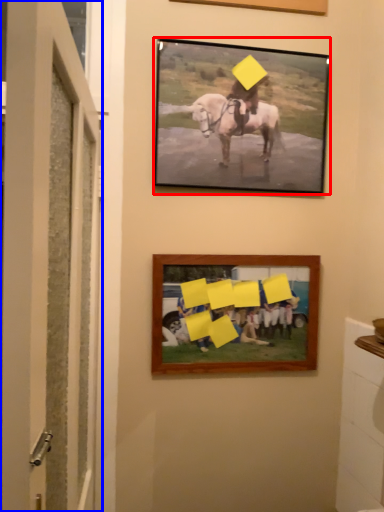
Question: Which object is closer to the camera taking this photo, picture frame (highlighted by a red box) or door (highlighted by a blue box)?

Choices:
 (A) picture frame
 (B) door

Answer: (B)